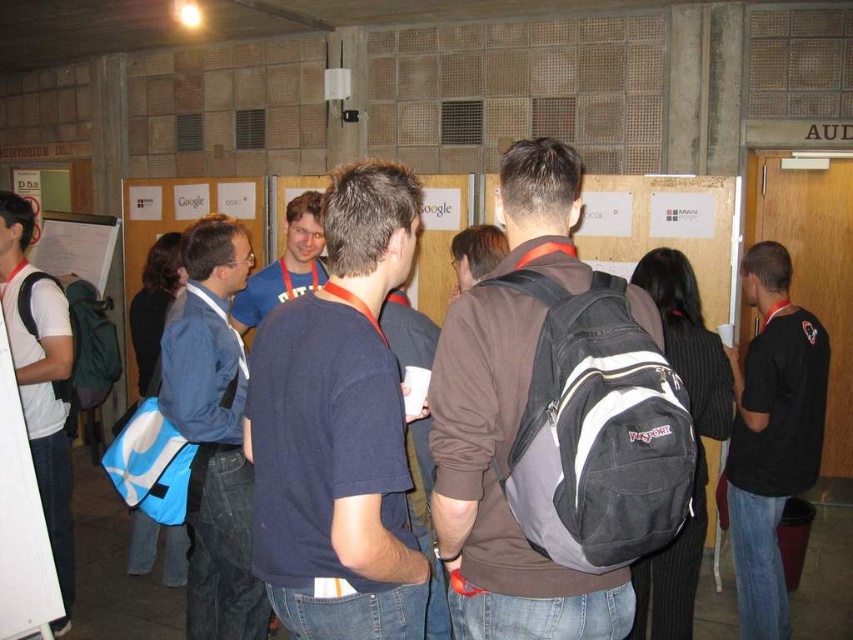
Question: In this image, where is dark blue t-shirt at center located relative to blue fabric bag at left?

Choices:
 (A) above
 (B) below

Answer: (A)

Question: Based on their relative distances, which object is nearer to the blue cotton t-shirt at center?

Choices:
 (A) black cotton shirt at right
 (B) white matte t-shirt at left

Answer: (B)

Question: Which object is positioned farthest from the white matte t-shirt at left?

Choices:
 (A) gray fabric backpack at center
 (B) black cotton shirt at right

Answer: (B)

Question: Is blue fabric bag at left thinner than black cotton shirt at right?

Choices:
 (A) yes
 (B) no

Answer: (B)

Question: Does dark brown backpack at center appear under gray fabric backpack at center?

Choices:
 (A) yes
 (B) no

Answer: (B)

Question: Which point is closer to the camera?

Choices:
 (A) (224, 289)
 (B) (503, 243)
 (C) (41, 470)
 (D) (277, 268)

Answer: (B)